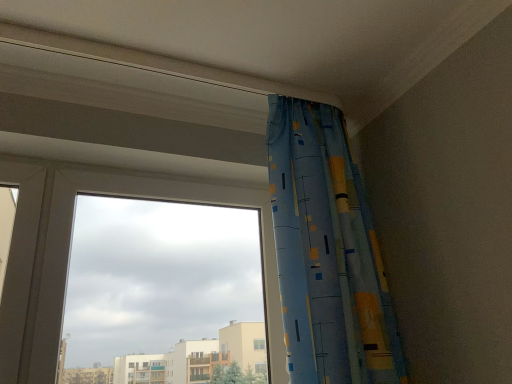
Question: Based on their sizes in the image, would you say transparent glass window at upper left is bigger or smaller than blue printed fabric curtain at upper right?

Choices:
 (A) small
 (B) big

Answer: (A)

Question: Which is correct: transparent glass window at upper left is inside blue printed fabric curtain at upper right, or outside of it?

Choices:
 (A) inside
 (B) outside

Answer: (B)

Question: Considering their positions, is transparent glass window at upper left located in front of or behind blue printed fabric curtain at upper right?

Choices:
 (A) front
 (B) behind

Answer: (B)

Question: Is blue printed fabric curtain at upper right bigger or smaller than transparent glass window at upper left?

Choices:
 (A) big
 (B) small

Answer: (A)

Question: Looking at their shapes, would you say blue printed fabric curtain at upper right is wider or thinner than transparent glass window at upper left?

Choices:
 (A) wide
 (B) thin

Answer: (A)

Question: Do you think blue printed fabric curtain at upper right is within transparent glass window at upper left, or outside of it?

Choices:
 (A) outside
 (B) inside

Answer: (A)

Question: From a real-world perspective, is blue printed fabric curtain at upper right positioned above or below transparent glass window at upper left?

Choices:
 (A) below
 (B) above

Answer: (B)